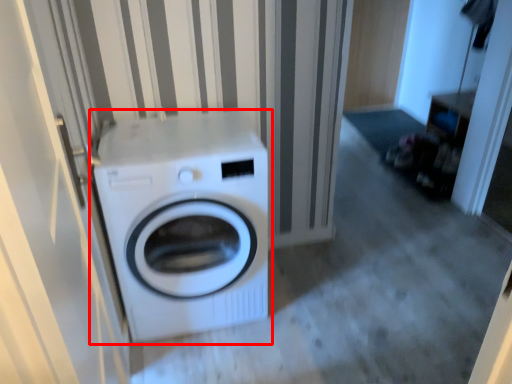
Question: From the image's perspective, what is the correct spatial positioning of washing machine (annotated by the red box) in reference to screen door?

Choices:
 (A) above
 (B) below

Answer: (A)